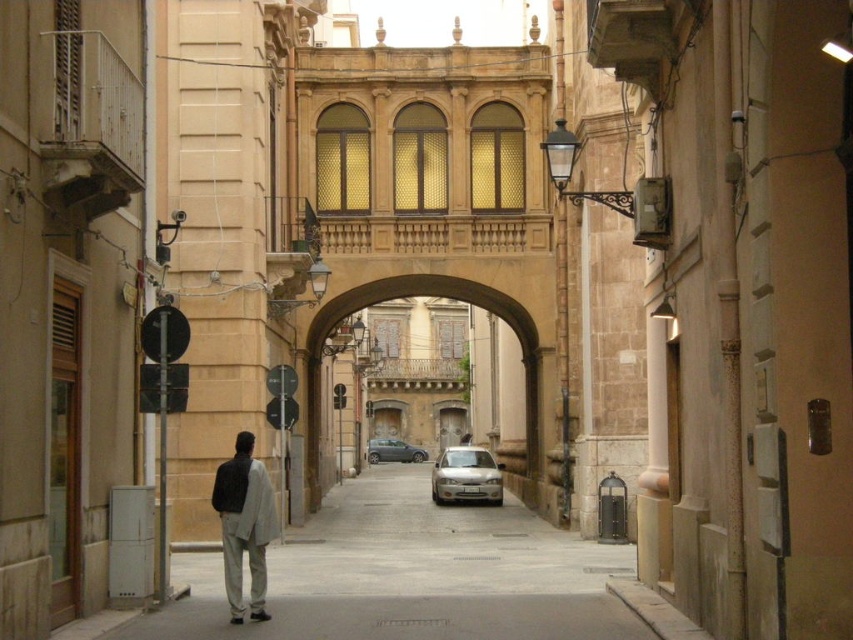
You are a delivery person standing at the entrance of the archway in the urban street scene. You need to place a package on the gray concrete pavement at center located at point (x=412, y=576). Which direction should you walk to reach the gray concrete pavement at center?

The gray concrete pavement at center is located at point (x=412, y=576), so you should walk forward through the archway to reach it.

You are a delivery person standing on the gray concrete pavement at center, and you need to deliver a package to the light beige pants at center. The delivery robot you are using has a maximum range of 7 meters. Can the robot reach the destination?

The gray concrete pavement at center and light beige pants at center are 7.20 meters apart from each other. Since the robot has a maximum range of 7 meters, it cannot reach the destination as the distance exceeds its limit.

You are a pedestrian standing at the entrance of the archway in the urban street scene. You see the light beige pants at center and the silver metallic car at center. Which object is closer to your left side?

The light beige pants at center is closer to your left side because it is positioned to the left of the silver metallic car at center.